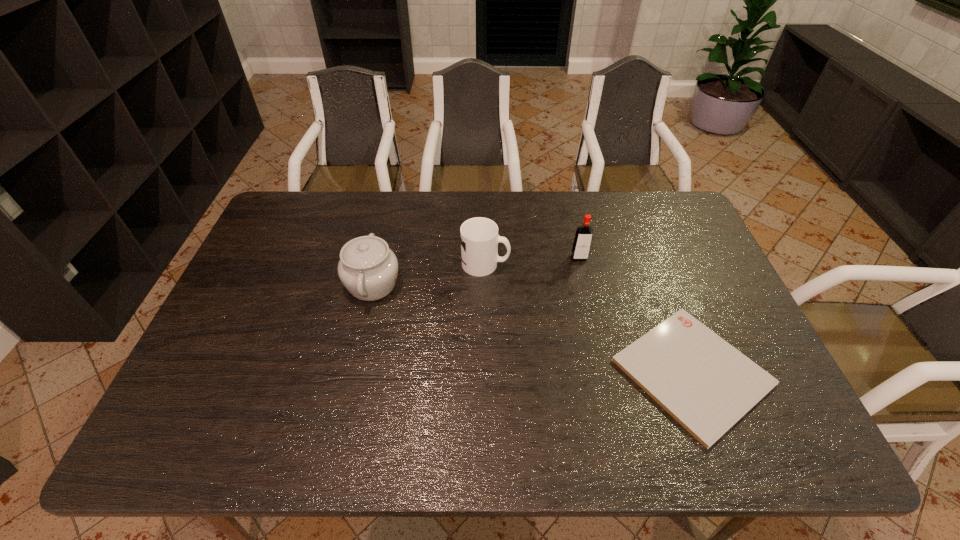
The width and height of the screenshot is (960, 540). What are the coordinates of `free spot between the leftmost object and the mug` in the screenshot? It's located at (429, 274).

Identify which object is the third closest to the vodka. Please provide its 2D coordinates. Your answer should be formatted as a tuple, i.e. [(x, y)], where the tuple contains the x and y coordinates of a point satisfying the conditions above.

[(368, 268)]

Find the location of a particular element. the closest object to the vodka is located at coordinates (479, 236).

Where is `free location that satisfies the following two spatial constraints: 1. on the back side of the shortest object; 2. on the handle side of the mug`? This screenshot has width=960, height=540. free location that satisfies the following two spatial constraints: 1. on the back side of the shortest object; 2. on the handle side of the mug is located at coordinates (651, 264).

Locate an element on the screen. free space that satisfies the following two spatial constraints: 1. on the front and back of the vodka; 2. on the right side of the clipboard is located at coordinates tap(605, 372).

Identify the location of free region that satisfies the following two spatial constraints: 1. on the front and back of the vodka; 2. on the handle side of the mug. (581, 264).

At what (x,y) coordinates should I click in order to perform the action: click on free location that satisfies the following two spatial constraints: 1. on the handle side of the mug; 2. on the right side of the clipboard. Please return your answer as a coordinate pair (x, y). Looking at the image, I should click on (487, 372).

Where is `free point that satisfies the following two spatial constraints: 1. on the front and back of the shortest object; 2. on the left side of the vodka`? The height and width of the screenshot is (540, 960). free point that satisfies the following two spatial constraints: 1. on the front and back of the shortest object; 2. on the left side of the vodka is located at coordinates (605, 372).

You are a GUI agent. You are given a task and a screenshot of the screen. Output one action in this format:
    pyautogui.click(x=<x>, y=<y>)
    Task: Click on the free spot that satisfies the following two spatial constraints: 1. on the back side of the shortest object; 2. on the handle side of the mug
    
    Given the screenshot: What is the action you would take?
    pyautogui.click(x=651, y=264)

Identify the location of free region that satisfies the following two spatial constraints: 1. on the front and back of the vodka; 2. on the handle side of the mug. The height and width of the screenshot is (540, 960). (581, 264).